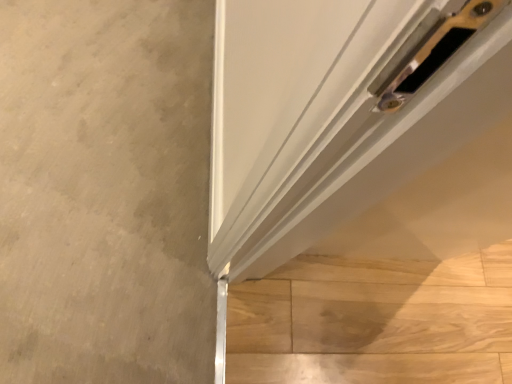
Image resolution: width=512 pixels, height=384 pixels. Identify the location of light wood floor at lower right. (374, 321).

The image size is (512, 384). What do you see at coordinates (374, 321) in the screenshot? I see `light wood floor at lower right` at bounding box center [374, 321].

You are a GUI agent. You are given a task and a screenshot of the screen. Output one action in this format:
    pyautogui.click(x=<x>, y=<y>)
    Task: Click on the light wood floor at lower right
    The height and width of the screenshot is (384, 512).
    Given the screenshot: What is the action you would take?
    pyautogui.click(x=374, y=321)